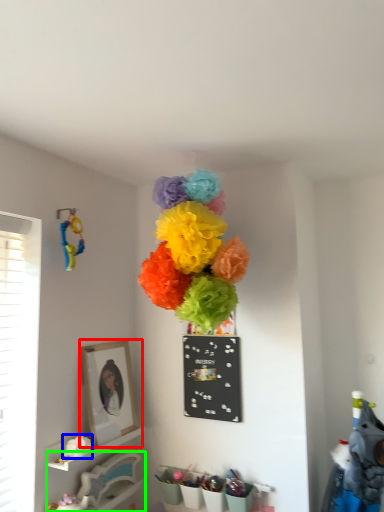
Question: Which object is positioned closest to picture frame (highlighted by a red box)? Select from flower (highlighted by a blue box) and furniture (highlighted by a green box).

Choices:
 (A) flower
 (B) furniture

Answer: (A)